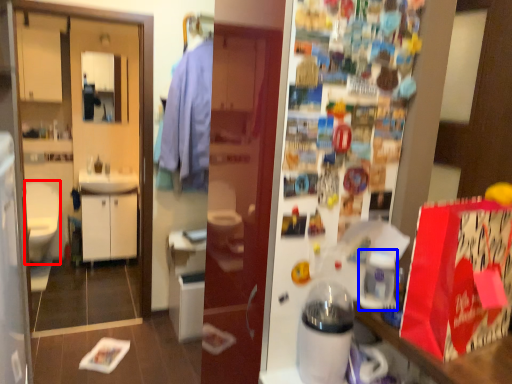
Question: Which object is further to the camera taking this photo, sit (highlighted by a red box) or appliance (highlighted by a blue box)?

Choices:
 (A) sit
 (B) appliance

Answer: (A)